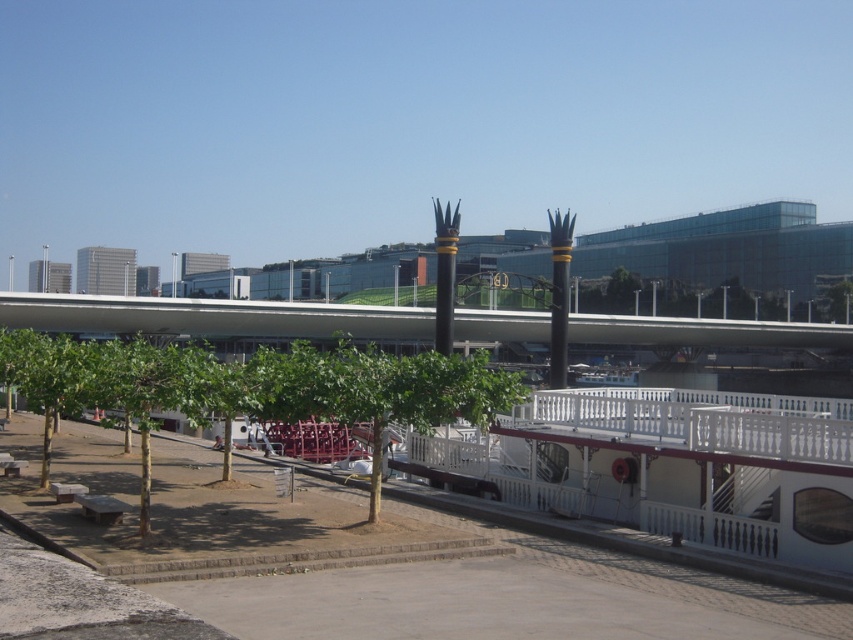
You are planning to install a bench between the green leafy tree at lower left and the green leafy tree at center. The bench requires at least 12 feet of space to be placed comfortably. Based on the scene, can the bench be placed between them?

The distance between the green leafy tree at lower left and the green leafy tree at center is 15.57 feet, which is more than the required 12 feet. Therefore, the bench can be placed between them comfortably.

You are a visitor standing at the waterfront and want to take a photo of both the green leafy tree at lower left and the green leafy tree at center. Which tree should you position closer to in order to capture both in the frame without moving the camera?

The green leafy tree at lower left is taller than the green leafy tree at center. To capture both in the frame without moving the camera, you should position closer to the shorter green leafy tree at center so that the taller tree at lower left doesn

You are standing at the waterfront and want to take a photo of the green leafy tree at lower left. If your camera can focus on objects up to 50 feet away, will you be able to capture a clear photo of the tree?

The green leafy tree at lower left is 48.63 feet away from the viewer, which is within the camera focus range of up to 50 feet. Therefore, you can capture a clear photo of the tree.